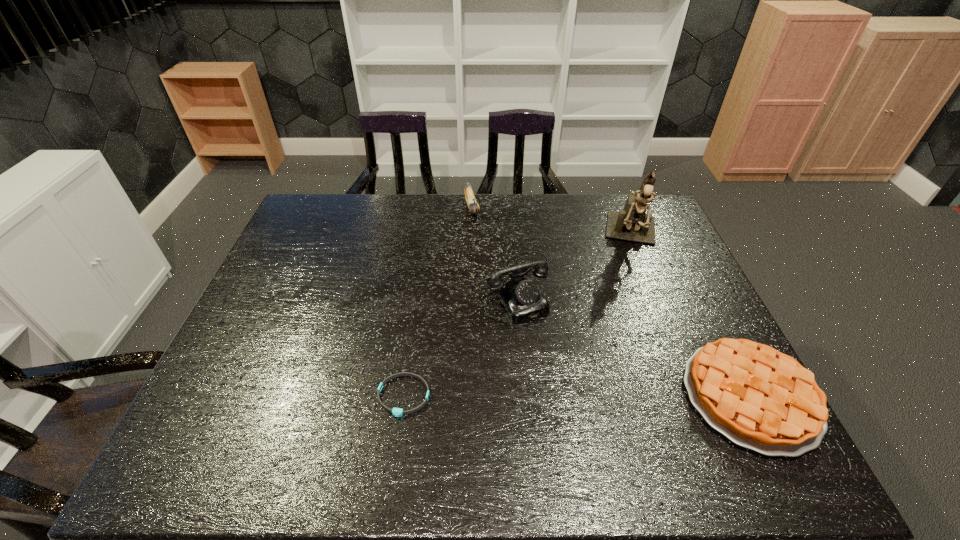
Point out which object is positioned as the second nearest to the banana. Please provide its 2D coordinates. Your answer should be formatted as a tuple, i.e. [(x, y)], where the tuple contains the x and y coordinates of a point satisfying the conditions above.

[(632, 224)]

Identify the location of vacant region that satisfies the following two spatial constraints: 1. on the buckle of the wristband; 2. on the left side of the second shortest object. Image resolution: width=960 pixels, height=540 pixels. (403, 396).

The width and height of the screenshot is (960, 540). I want to click on vacant area that satisfies the following two spatial constraints: 1. on the buckle of the second shortest object; 2. on the left side of the leftmost object, so point(403,396).

Where is `vacant space that satisfies the following two spatial constraints: 1. on the front side of the banana; 2. on the left side of the second shortest object`? The width and height of the screenshot is (960, 540). vacant space that satisfies the following two spatial constraints: 1. on the front side of the banana; 2. on the left side of the second shortest object is located at coordinates (468, 396).

Locate an element on the screen. free region that satisfies the following two spatial constraints: 1. on the buckle of the leftmost object; 2. on the left side of the pie is located at coordinates (403, 396).